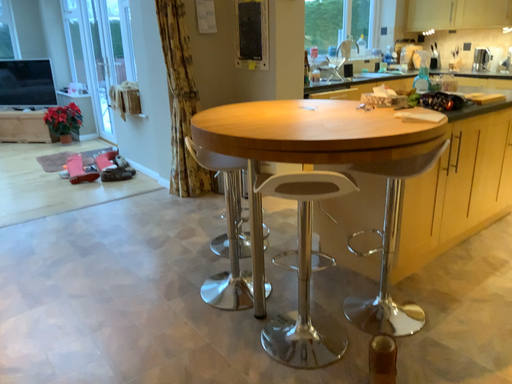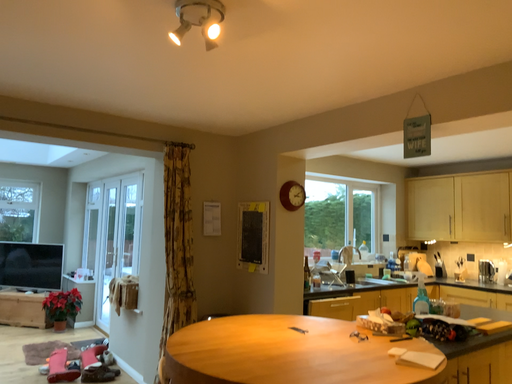
Question: Which way did the camera rotate in the video?

Choices:
 (A) rotated downward
 (B) rotated upward

Answer: (B)